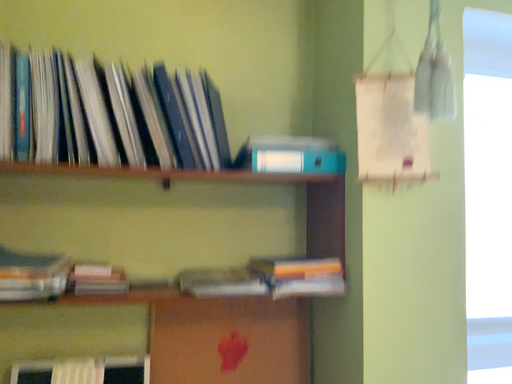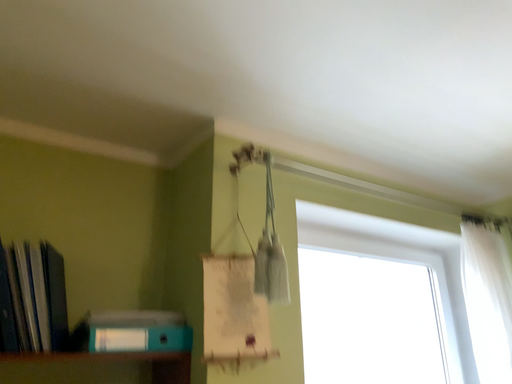
Question: How did the camera likely rotate when shooting the video?

Choices:
 (A) rotated downward
 (B) rotated upward

Answer: (B)